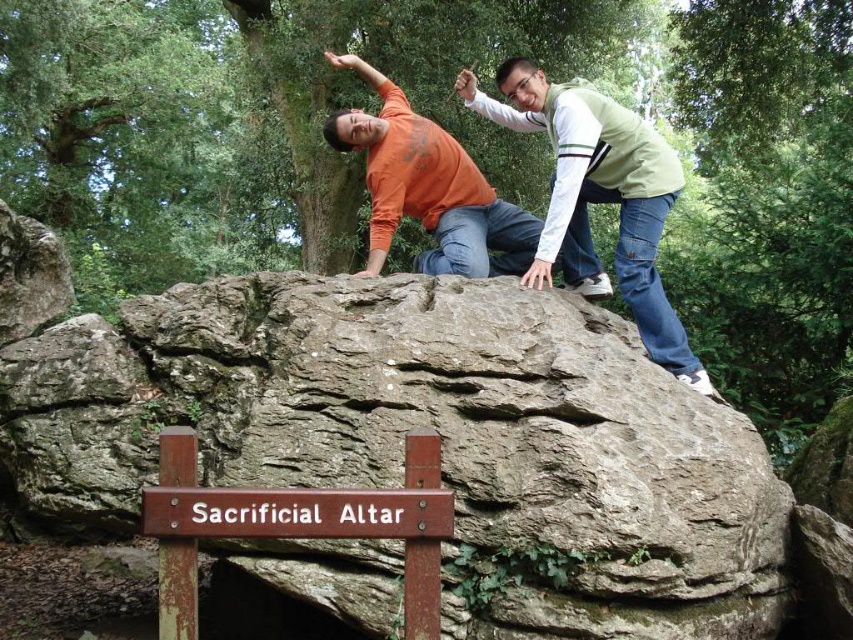
Is green textured vest at upper right taller than brown wooden sign at lower center?

Yes, green textured vest at upper right is taller than brown wooden sign at lower center.

Does point (567, 97) come behind point (221, 524)?

Yes, it is behind point (221, 524).

Measure the distance between green textured vest at upper right and camera.

green textured vest at upper right and camera are 11.99 feet apart from each other.

Image resolution: width=853 pixels, height=640 pixels. What are the coordinates of `green textured vest at upper right` in the screenshot? It's located at pyautogui.click(x=598, y=198).

Is brown wooden sign at lower center thinner than orange matte shirt at upper center?

Yes, brown wooden sign at lower center is thinner than orange matte shirt at upper center.

Between brown wooden sign at lower center and orange matte shirt at upper center, which one is positioned lower?

brown wooden sign at lower center is below.

Between point (364, 492) and point (515, 272), which one is positioned behind?

The point (515, 272) is more distant.

The width and height of the screenshot is (853, 640). Identify the location of brown wooden sign at lower center. (296, 525).

Which is in front, point (575, 147) or point (502, 209)?

Point (575, 147) is more forward.

Which is behind, point (633, 148) or point (451, 260)?

The point (451, 260) is behind.

Between point (679, 378) and point (383, 113), which one is positioned in front?

Point (679, 378) is in front.

This screenshot has height=640, width=853. What are the coordinates of `green textured vest at upper right` in the screenshot? It's located at (598, 198).